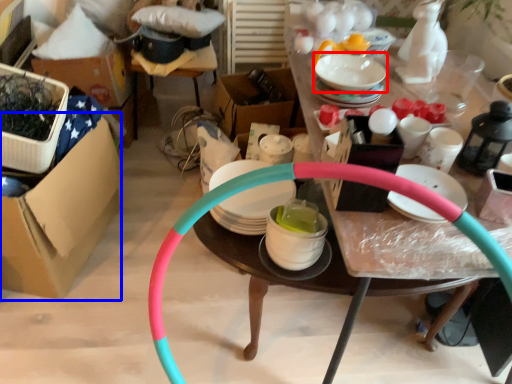
Question: Which of the following is the farthest to the observer, tableware (highlighted by a red box) or cardboard box (highlighted by a blue box)?

Choices:
 (A) tableware
 (B) cardboard box

Answer: (A)